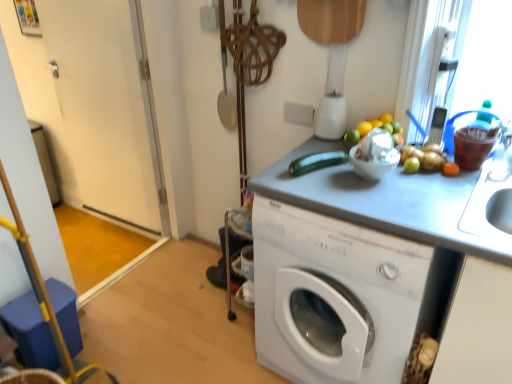
Find the location of a particular element. The height and width of the screenshot is (384, 512). white glossy door at left is located at coordinates (108, 108).

Locate an element on the screen. Image resolution: width=512 pixels, height=384 pixels. white plastic blender at upper center is located at coordinates (333, 97).

Which object is wider, white glossy bowl at center or white glossy door at left?

white glossy bowl at center is wider.

How different are the orientations of white glossy bowl at center and white glossy door at left in degrees?

The angular difference between white glossy bowl at center and white glossy door at left is 1.54 degrees.

This screenshot has width=512, height=384. I want to click on screen door that is under the white glossy bowl at center (from a real-world perspective), so click(x=108, y=108).

From the image's perspective, is white glossy bowl at center located above white glossy door at left?

Actually, white glossy bowl at center appears below white glossy door at left in the image.

From the image's perspective, is white glossy bowl at center over green matte zucchini at center?

No, from the image's perspective, white glossy bowl at center is not on top of green matte zucchini at center.

Can you confirm if white glossy bowl at center is positioned to the left of green matte zucchini at center?

No.

From a real-world perspective, is white glossy bowl at center physically below green matte zucchini at center?

No, from a real-world perspective, white glossy bowl at center is not under green matte zucchini at center.

In the image, is white glossy bowl at center positioned in front of or behind green matte zucchini at center?

Visually, white glossy bowl at center is located in front of green matte zucchini at center.

From the image's perspective, is white plastic blender at upper center positioned above or below white glossy bowl at center?

white plastic blender at upper center is above white glossy bowl at center.

Does white plastic blender at upper center have a lesser width compared to white glossy bowl at center?

Indeed, white plastic blender at upper center has a lesser width compared to white glossy bowl at center.

Does point (324, 110) lie behind point (368, 179)?

Yes, it is behind point (368, 179).

The width and height of the screenshot is (512, 384). I want to click on blender on the left of white glossy bowl at center, so click(x=333, y=97).

Considering their positions, is white glossy bowl at center located in front of or behind white plastic blender at upper center?

Visually, white glossy bowl at center is located in front of white plastic blender at upper center.

Is white glossy bowl at center with white plastic blender at upper center?

No.

Considering the relative sizes of white plastic blender at upper center and white glossy door at left in the image provided, is white plastic blender at upper center shorter than white glossy door at left?

Indeed, white plastic blender at upper center has a lesser height compared to white glossy door at left.

Is there a large distance between white plastic blender at upper center and white glossy door at left?

Yes.

Considering the positions of objects white plastic blender at upper center and white glossy door at left in the image provided, who is more to the left, white plastic blender at upper center or white glossy door at left?

white glossy door at left is more to the left.

At what (x,y) coordinates should I click in order to perform the action: click on basin that appears below the white glossy door at left (from the image's perspective). Please return your answer as a coordinate pair (x, y). The height and width of the screenshot is (384, 512). Looking at the image, I should click on (373, 164).

Could you tell me if white glossy door at left is turned towards white glossy bowl at center?

No, white glossy door at left is not aimed at white glossy bowl at center.

Can you tell me how much white glossy door at left and white glossy bowl at center differ in facing direction?

The angle between the facing direction of white glossy door at left and the facing direction of white glossy bowl at center is 1.54 degrees.

From the image's perspective, is white glossy door at left above or below white glossy bowl at center?

white glossy door at left is above white glossy bowl at center.

Is green matte zucchini at center not close to white glossy bowl at center?

No, green matte zucchini at center is not far from white glossy bowl at center.

Is green matte zucchini at center bigger or smaller than white glossy bowl at center?

In the image, green matte zucchini at center appears to be smaller than white glossy bowl at center.

Measure the distance between green matte zucchini at center and white glossy bowl at center.

The distance of green matte zucchini at center from white glossy bowl at center is 17.01 centimeters.

Does green matte zucchini at center appear on the left side of white glossy bowl at center?

Correct, you'll find green matte zucchini at center to the left of white glossy bowl at center.

Where is `screen door located above the white glossy bowl at center (from the image's perspective)`? This screenshot has width=512, height=384. screen door located above the white glossy bowl at center (from the image's perspective) is located at coordinates (108, 108).

The height and width of the screenshot is (384, 512). I want to click on basin lying on the right of green matte zucchini at center, so click(x=373, y=164).

Which object lies nearer to the anchor point green matte zucchini at center, white glossy bowl at center or white glossy door at left?

Among the two, white glossy bowl at center is located nearer to green matte zucchini at center.

From the image, which object appears to be nearer to white glossy bowl at center, white plastic blender at upper center or green matte zucchini at center?

green matte zucchini at center.

Considering their positions, is white glossy door at left positioned further to green matte zucchini at center than white glossy washing machine at center?

white glossy door at left.

Based on their spatial positions, is green matte zucchini at center or white glossy door at left closer to white glossy washing machine at center?

green matte zucchini at center is closer to white glossy washing machine at center.

Looking at the image, which one is located closer to green matte zucchini at center, white plastic blender at upper center or white glossy washing machine at center?

white plastic blender at upper center.

When comparing their distances from white glossy washing machine at center, does white plastic blender at upper center or white glossy door at left seem further?

white glossy door at left lies further to white glossy washing machine at center than the other object.

Based on their spatial positions, is white glossy bowl at center or green matte zucchini at center closer to white plastic blender at upper center?

Based on the image, green matte zucchini at center appears to be nearer to white plastic blender at upper center.

Considering their positions, is green matte zucchini at center positioned further to white glossy washing machine at center than white glossy bowl at center?

green matte zucchini at center is further to white glossy washing machine at center.

Identify the location of blender located between white glossy door at left and white glossy bowl at center in the left-right direction. This screenshot has width=512, height=384. (333, 97).

The height and width of the screenshot is (384, 512). Identify the location of vegetable between white glossy door at left and white glossy bowl at center. (316, 162).

I want to click on basin located between white glossy door at left and white glossy washing machine at center in the left-right direction, so click(x=373, y=164).

You are a GUI agent. You are given a task and a screenshot of the screen. Output one action in this format:
    pyautogui.click(x=<x>, y=<y>)
    Task: Click on the vegetable between white plastic blender at upper center and white glossy bowl at center vertically
    The image size is (512, 384).
    Given the screenshot: What is the action you would take?
    pyautogui.click(x=316, y=162)